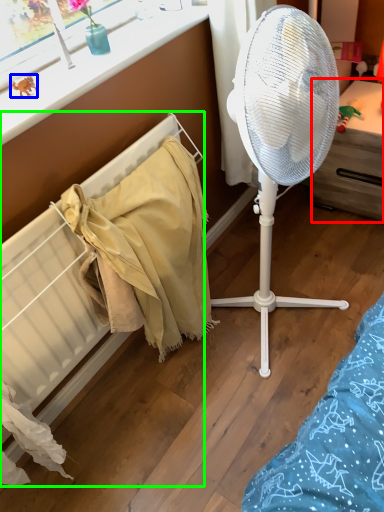
Question: Which is farther away from furniture (highlighted by a red box)? toy (highlighted by a blue box) or radiator (highlighted by a green box)?

Choices:
 (A) toy
 (B) radiator

Answer: (A)